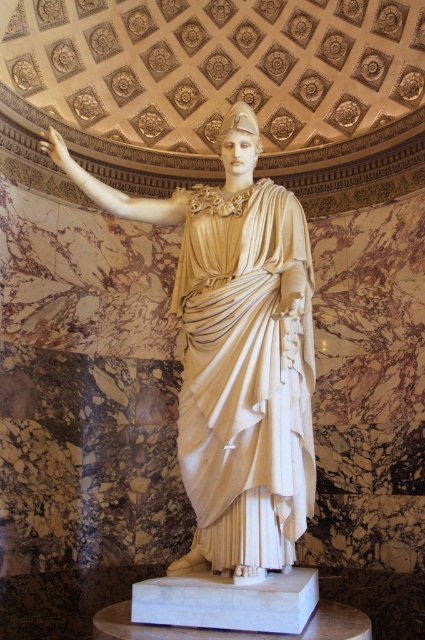
You are an art curator planning to install a spotlight at point (237, 353). Which object in the scene is exactly at that coordinate?

The white marble statue at center is located at point (237, 353).

You are an interior designer assessing the space around the white marble statue at center and the white marble robe at center. Which object is taller?

The white marble statue at center is taller than the white marble robe at center.